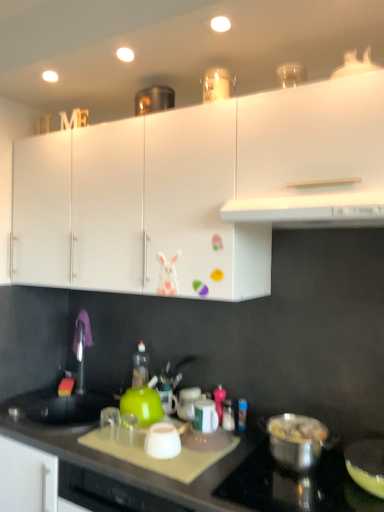
Question: Should I look upward or downward to see stainless steel pot at lower right?

Choices:
 (A) up
 (B) down

Answer: (B)

Question: Is shiny metallic pot at lower right, which is the first kitchen appliance from right to left, taller than white glossy jar at center?

Choices:
 (A) no
 (B) yes

Answer: (B)

Question: Is shiny metallic pot at lower right, which is the first kitchen appliance from right to left, turned away from white glossy jar at center?

Choices:
 (A) yes
 (B) no

Answer: (B)

Question: From a real-world perspective, is shiny metallic pot at lower right, which is the first kitchen appliance from right to left, positioned under white glossy jar at center based on gravity?

Choices:
 (A) yes
 (B) no

Answer: (A)

Question: Is shiny metallic pot at lower right, which is the first kitchen appliance from right to left, far from white glossy jar at center?

Choices:
 (A) no
 (B) yes

Answer: (A)

Question: Is shiny metallic pot at lower right, which is the first kitchen appliance from right to left, further to camera compared to white glossy jar at center?

Choices:
 (A) no
 (B) yes

Answer: (A)

Question: Could you tell me if shiny metallic pot at lower right, acting as the 4th kitchen appliance starting from the left, is turned towards white glossy jar at center?

Choices:
 (A) no
 (B) yes

Answer: (A)

Question: Can you see white glossy cabinet at upper center, arranged as the third cabinetry when viewed from the right, touching white glossy cup at center, which appears as the second kitchen appliance when viewed from the left?

Choices:
 (A) no
 (B) yes

Answer: (A)

Question: From the image's perspective, does white glossy cabinet at upper center, which is the 1th cabinetry from left to right, appear lower than white glossy cup at center, marked as the 3th kitchen appliance in a right-to-left arrangement?

Choices:
 (A) no
 (B) yes

Answer: (A)

Question: Is white glossy cabinet at upper center, arranged as the third cabinetry when viewed from the right, bigger than white glossy cup at center, which appears as the second kitchen appliance when viewed from the left?

Choices:
 (A) yes
 (B) no

Answer: (A)

Question: Is white glossy cabinet at upper center, which is the 1th cabinetry from left to right, not close to white glossy cup at center, marked as the 3th kitchen appliance in a right-to-left arrangement?

Choices:
 (A) yes
 (B) no

Answer: (B)

Question: Can you confirm if white glossy cabinet at upper center, arranged as the third cabinetry when viewed from the right, is wider than white glossy cup at center, which appears as the second kitchen appliance when viewed from the left?

Choices:
 (A) no
 (B) yes

Answer: (B)

Question: Can you confirm if white glossy cabinet at upper center, arranged as the third cabinetry when viewed from the right, is shorter than white glossy cup at center, which appears as the second kitchen appliance when viewed from the left?

Choices:
 (A) yes
 (B) no

Answer: (B)

Question: Can you confirm if black matte countertop at lower center is positioned to the left of white glossy jar at center?

Choices:
 (A) no
 (B) yes

Answer: (B)